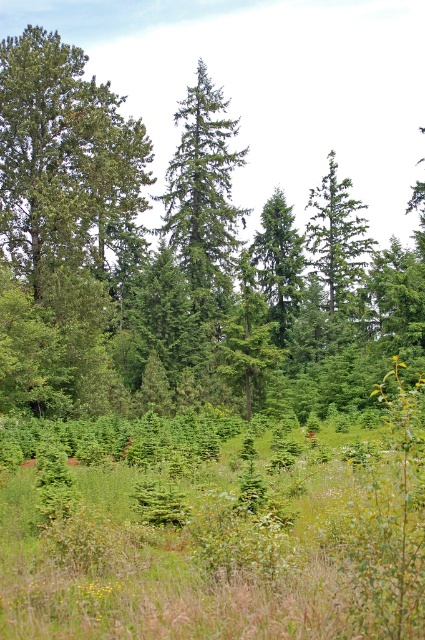
Question: Which object is the farthest from the green matte tree at upper right?

Choices:
 (A) green matte tree at center
 (B) green leafy tree at upper center

Answer: (B)

Question: From the image, what is the correct spatial relationship of green leafy tree at upper center in relation to green matte tree at upper right?

Choices:
 (A) left
 (B) right

Answer: (A)

Question: Which object appears closest to the camera in this image?

Choices:
 (A) green matte tree at center
 (B) green matte tree at upper right

Answer: (B)

Question: Which point is farther from the camera taking this photo?

Choices:
 (A) (342, 292)
 (B) (263, 214)

Answer: (B)

Question: Is green leafy tree at upper center above green matte tree at center?

Choices:
 (A) yes
 (B) no

Answer: (A)

Question: Is green matte tree at upper right to the left of green matte tree at center from the viewer's perspective?

Choices:
 (A) yes
 (B) no

Answer: (B)